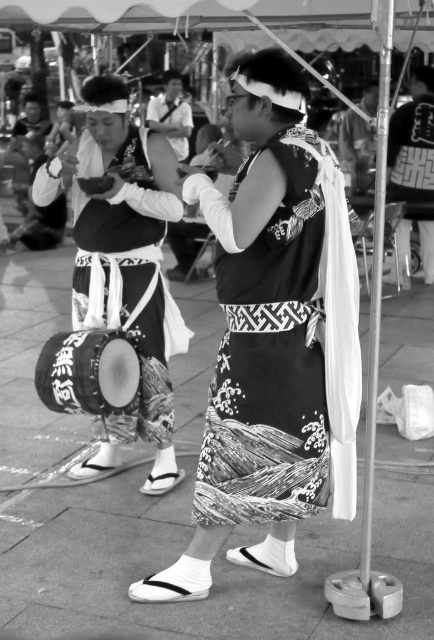
Question: Does black printed fabric dress at center appear under black fabric drum at left?

Choices:
 (A) yes
 (B) no

Answer: (A)

Question: Which object appears farthest from the camera in this image?

Choices:
 (A) black printed fabric dress at center
 (B) black drum at center
 (C) smooth fabric kimono at center

Answer: (C)

Question: Is black printed fabric dress at center thinner than smooth fabric kimono at center?

Choices:
 (A) no
 (B) yes

Answer: (B)

Question: Does black printed fabric dress at center appear on the right side of black drum at center?

Choices:
 (A) yes
 (B) no

Answer: (A)

Question: Which of these objects is positioned farthest from the black fabric drum at left?

Choices:
 (A) black printed fabric dress at center
 (B) smooth fabric kimono at center

Answer: (B)

Question: Which of the following is the closest to the observer?

Choices:
 (A) (220, 435)
 (B) (154, 106)
 (C) (76, 220)

Answer: (A)